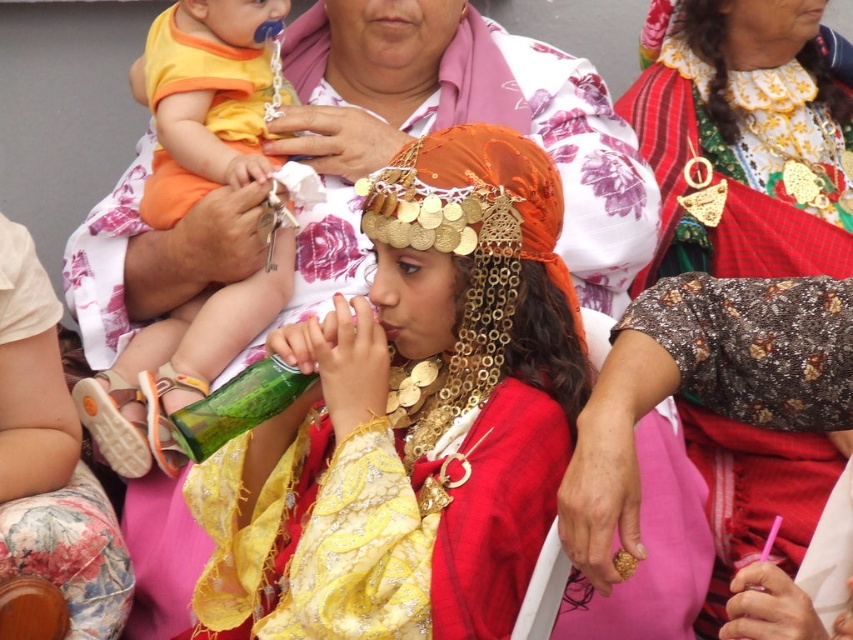
Is shiny metallic headpiece at center closer to the viewer compared to matte orange bib at upper left?

That is True.

Looking at this image, is shiny metallic headpiece at center further to camera compared to matte orange bib at upper left?

No, shiny metallic headpiece at center is in front of matte orange bib at upper left.

Where is `shiny metallic headpiece at center`? Image resolution: width=853 pixels, height=640 pixels. shiny metallic headpiece at center is located at coordinates (585, 164).

Is floral fabric dress at center above matte orange bib at upper left?

No, floral fabric dress at center is not above matte orange bib at upper left.

Can you confirm if floral fabric dress at center is wider than matte orange bib at upper left?

Correct, the width of floral fabric dress at center exceeds that of matte orange bib at upper left.

This screenshot has width=853, height=640. I want to click on floral fabric dress at center, so click(x=746, y=138).

At what (x,y) coordinates should I click in order to perform the action: click on floral fabric dress at center. Please return your answer as a coordinate pair (x, y). The height and width of the screenshot is (640, 853). Looking at the image, I should click on (746, 138).

Is shiny metallic headpiece at center thinner than green glass bottle at center?

No, shiny metallic headpiece at center is not thinner than green glass bottle at center.

Between shiny metallic headpiece at center and green glass bottle at center, which one is positioned higher?

shiny metallic headpiece at center

Between point (556, 51) and point (250, 424), which one is positioned behind?

The point (556, 51) is more distant.

The image size is (853, 640). Find the location of `shiny metallic headpiece at center`. shiny metallic headpiece at center is located at coordinates (585, 164).